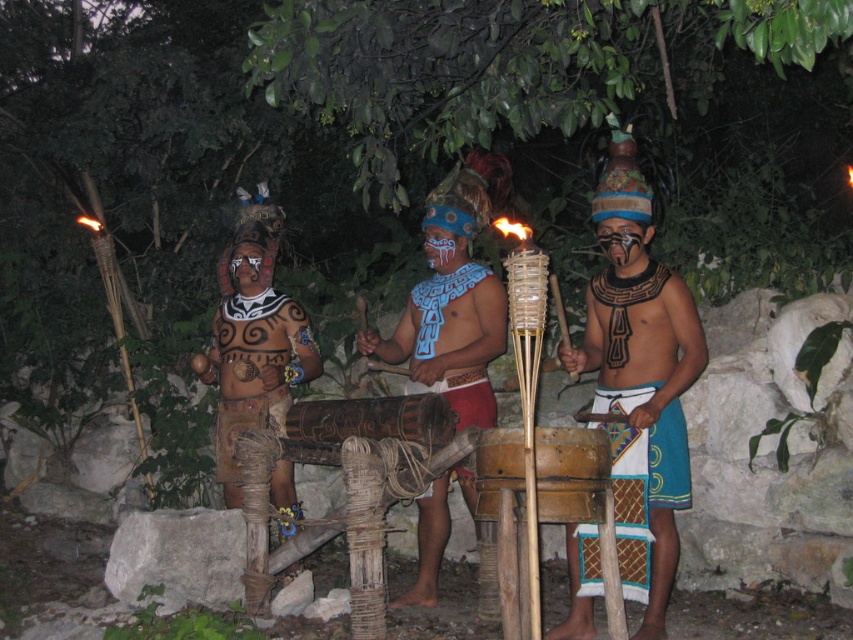
What are the coordinates of the blue painted wood drum at center?

The coordinates of the blue painted wood drum at center are at point (456, 300).

You are standing at the origin point in the image. Which of the two points, point (221, 268) or point (259, 259), is closer to you?

Point (259, 259) is closer to you because it is in front of point (221, 268).

In the nighttime forest scene with torches, there is a matte blue fabric at center and a wooden drum at center. Which object is larger?

The matte blue fabric at center is bigger than the wooden drum at center.